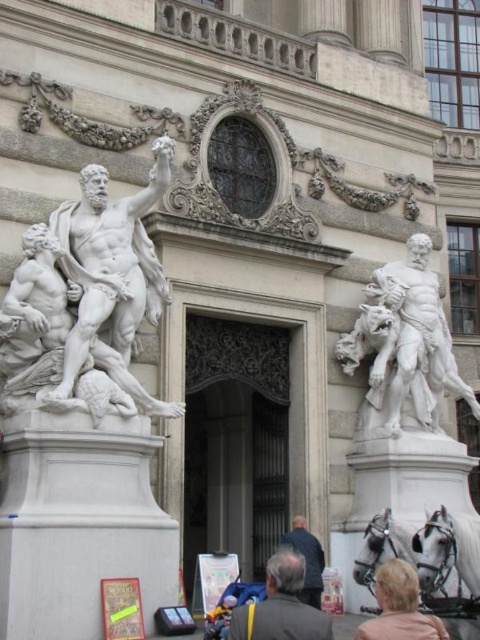
Question: Can you confirm if metallic silver coach at lower center is positioned to the left of metallic silver coach at center?

Choices:
 (A) no
 (B) yes

Answer: (B)

Question: Does white marble statue at left have a larger size compared to white marble statue at right?

Choices:
 (A) yes
 (B) no

Answer: (A)

Question: Which of the following is the farthest from the observer?

Choices:
 (A) (356, 358)
 (B) (27, 253)
 (C) (312, 588)
 (D) (326, 627)

Answer: (A)

Question: Which object appears closest to the camera in this image?

Choices:
 (A) white glossy horse at lower right
 (B) metallic silver coach at center

Answer: (B)

Question: Can you confirm if white marble statue at right is positioned to the left of white glossy horse at lower right?

Choices:
 (A) yes
 (B) no

Answer: (B)

Question: Among these objects, which one is farthest from the camera?

Choices:
 (A) metallic silver coach at lower center
 (B) white glossy horse at lower right
 (C) white marble statue at left
 (D) metallic silver coach at center

Answer: (B)